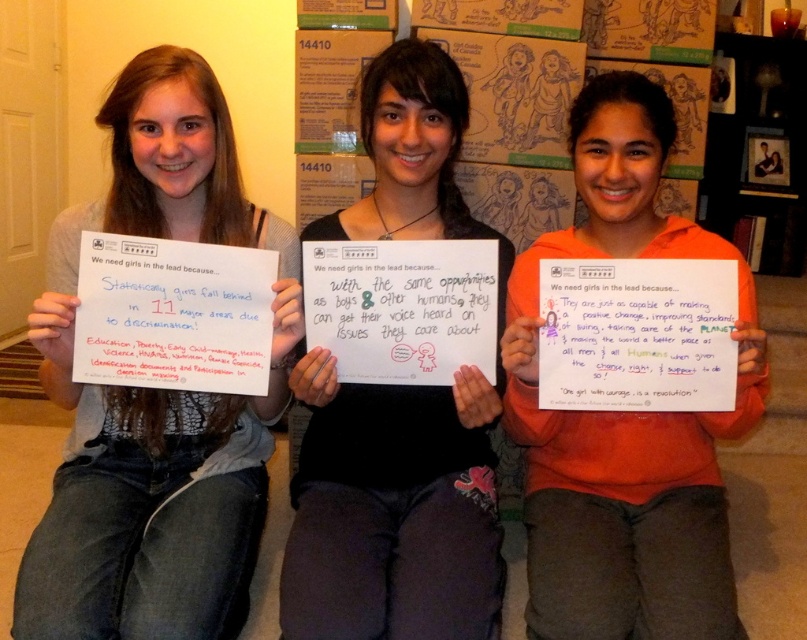
Describe the element at coordinates (155, 394) in the screenshot. This screenshot has width=807, height=640. I see `gray sweater at center` at that location.

Between point (67, 596) and point (592, 113), which one is positioned behind?

Point (592, 113)

Who is more distant from viewer, (191, 451) or (521, 352)?

The point (191, 451) is more distant.

I want to click on gray sweater at center, so click(155, 394).

Can you confirm if white paper at center is shorter than orange cotton shirt at center?

No, white paper at center is not shorter than orange cotton shirt at center.

Who is positioned more to the right, white paper at center or orange cotton shirt at center?

orange cotton shirt at center is more to the right.

The height and width of the screenshot is (640, 807). What do you see at coordinates (392, 509) in the screenshot?
I see `white paper at center` at bounding box center [392, 509].

The image size is (807, 640). Identify the location of white paper at center. (392, 509).

What do you see at coordinates (155, 394) in the screenshot? I see `gray sweater at center` at bounding box center [155, 394].

Who is positioned more to the right, gray sweater at center or white paper at center?

white paper at center

Which is in front, point (174, 580) or point (324, 426)?

Point (174, 580) is in front.

Where is `gray sweater at center`? Image resolution: width=807 pixels, height=640 pixels. gray sweater at center is located at coordinates (155, 394).